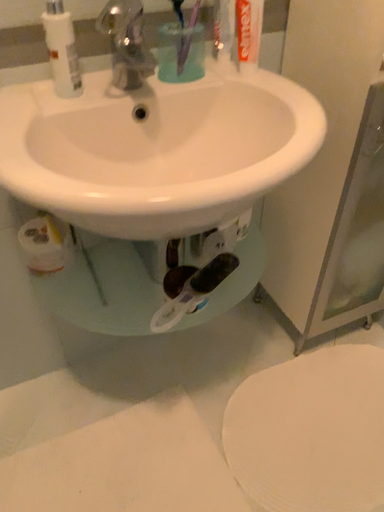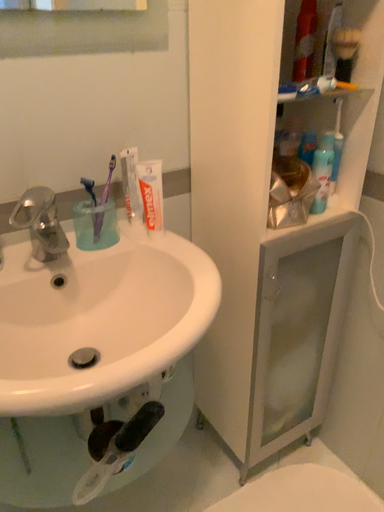
Question: How did the camera likely rotate when shooting the video?

Choices:
 (A) rotated downward
 (B) rotated upward

Answer: (B)